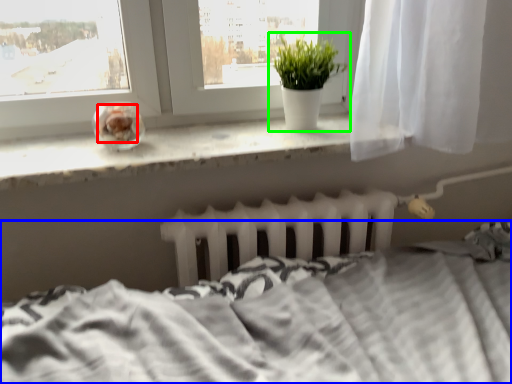
Question: Which is nearer to the food (highlighted by a red box)? bed (highlighted by a blue box) or houseplant (highlighted by a green box).

Choices:
 (A) bed
 (B) houseplant

Answer: (B)